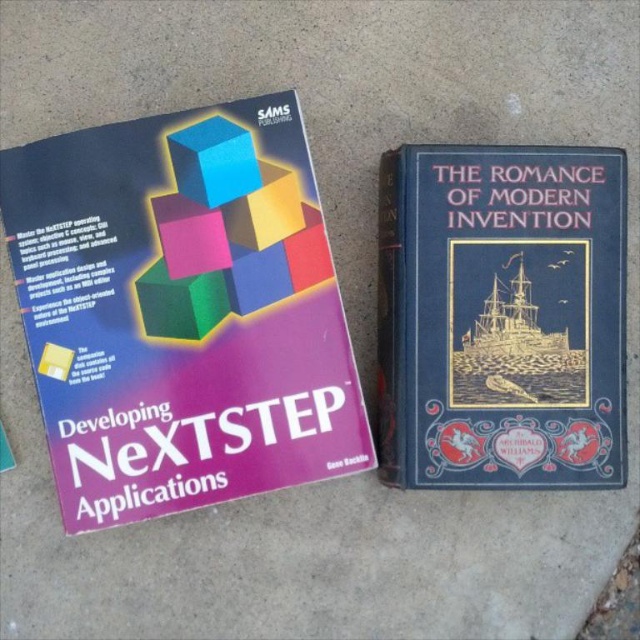
Does matte purple book at left have a lesser height compared to blue matte cube at upper left?

No.

Who is more distant from viewer, (56,145) or (241,148)?

Positioned behind is point (241,148).

Which is in front, point (36, 189) or point (221, 168)?

Point (36, 189)

Where is `matte purple book at left`? matte purple book at left is located at coordinates (180, 310).

Does blue hardcover book at right have a larger size compared to blue matte cube at upper left?

Yes.

Does blue hardcover book at right appear on the left side of blue matte cube at upper left?

No, blue hardcover book at right is not to the left of blue matte cube at upper left.

Does point (611, 304) lie in front of point (227, 176)?

Yes, point (611, 304) is in front of point (227, 176).

Locate an element on the screen. blue hardcover book at right is located at coordinates (500, 316).

From the picture: Between matte purple book at left and blue hardcover book at right, which one is positioned higher?

Positioned higher is matte purple book at left.

Who is more distant from viewer, (289,419) or (506,228)?

The point (289,419) is behind.

Is point (129, 387) less distant than point (522, 269)?

Yes.

Where is `matte purple book at left`? This screenshot has width=640, height=640. matte purple book at left is located at coordinates (180, 310).